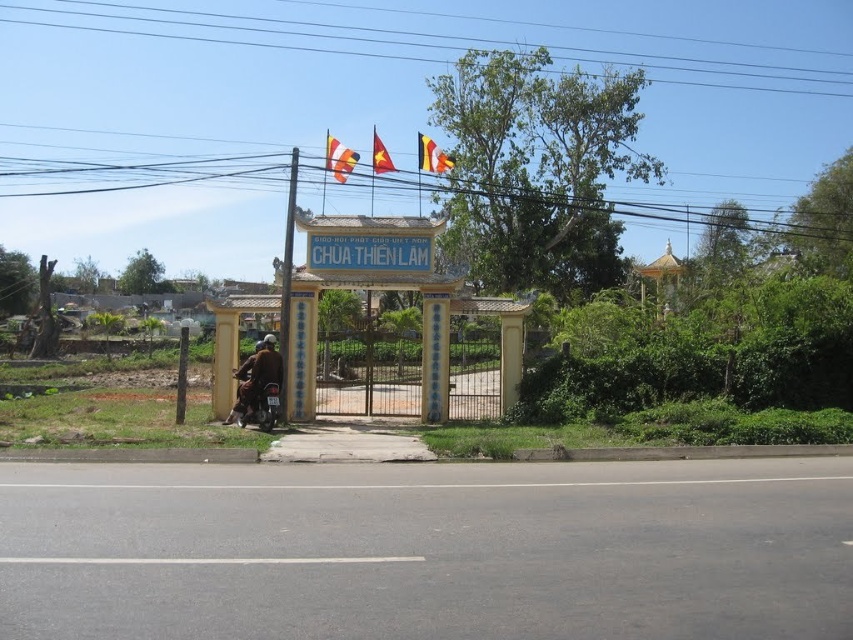
Is point (339, 163) farther from camera compared to point (376, 148)?

No, (339, 163) is in front of (376, 148).

Which of these two, orange fabric flag at upper center or red fabric flag at center, stands shorter?

orange fabric flag at upper center

Is point (334, 140) in front of point (375, 129)?

Yes, it is in front of point (375, 129).

The image size is (853, 640). Find the location of `orange fabric flag at upper center`. orange fabric flag at upper center is located at coordinates (338, 157).

Can you confirm if white painted wood sign at center is smaller than brown leather jacket at lower left?

Yes.

Which is in front, point (322, 252) or point (239, 396)?

Point (239, 396) is in front.

Where is `white painted wood sign at center`? white painted wood sign at center is located at coordinates (368, 252).

Does point (321, 48) come behind point (424, 138)?

Yes, point (321, 48) is behind point (424, 138).

Is clear blue wires at upper center below yellow fabric flag at upper center?

Incorrect, clear blue wires at upper center is not positioned below yellow fabric flag at upper center.

This screenshot has height=640, width=853. I want to click on clear blue wires at upper center, so click(412, 44).

Locate an element on the screen. Image resolution: width=853 pixels, height=640 pixels. clear blue wires at upper center is located at coordinates (412, 44).